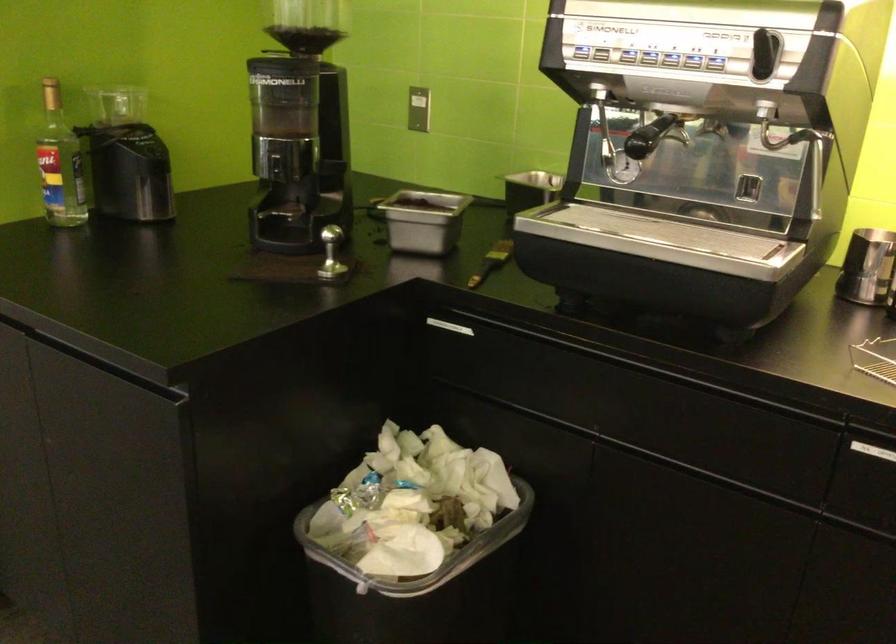
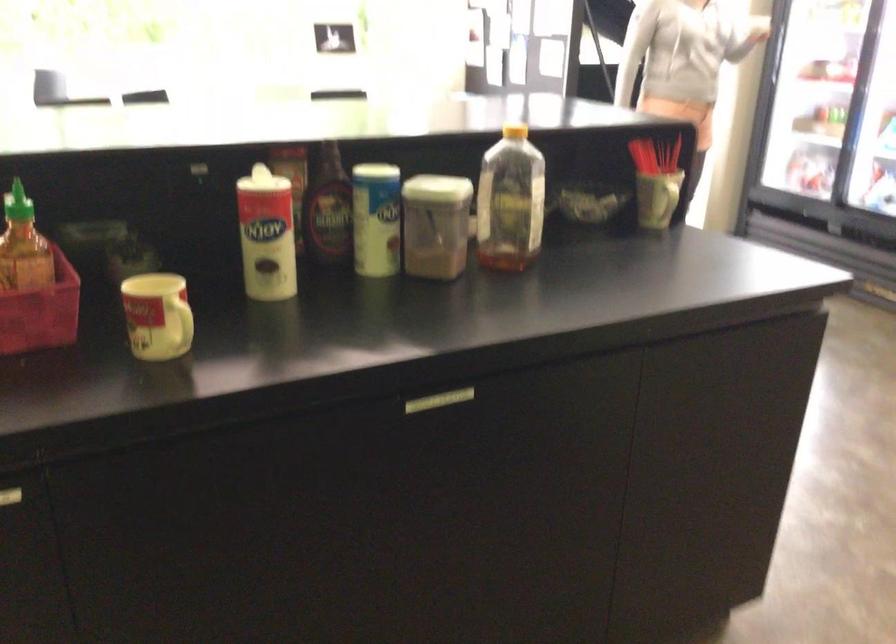
The first image is from the beginning of the video and the second image is from the end. How did the camera likely rotate when shooting the video?

The rotation direction of the camera is left-down.